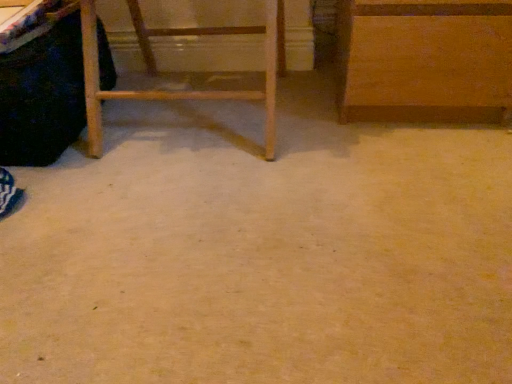
Identify the location of vacant space in wooden ladder at left, the first furniture positioned from the left (from a real-world perspective). The image size is (512, 384). (196, 123).